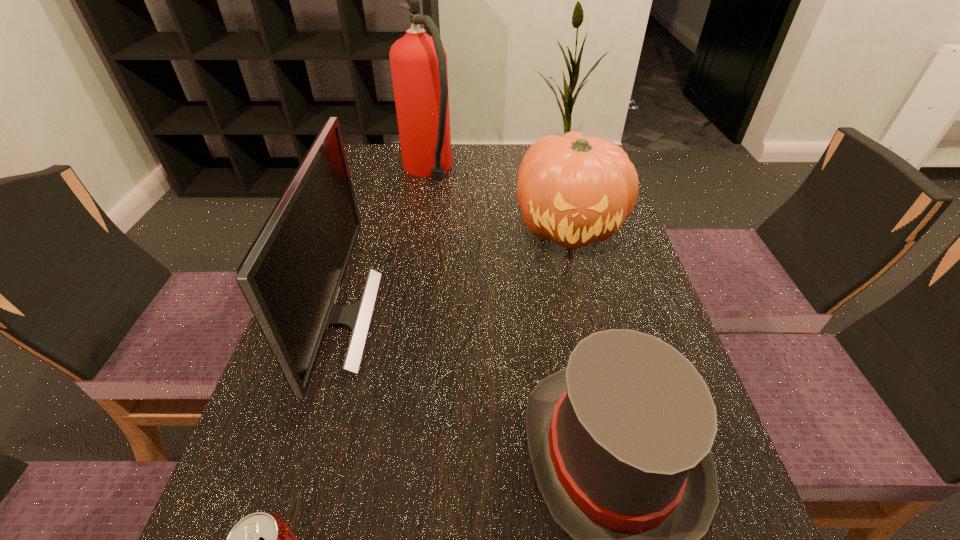
The image size is (960, 540). In order to click on vacant region at the far edge in this screenshot , I will do `click(468, 165)`.

Locate an element on the screen. This screenshot has height=540, width=960. free space at the left edge is located at coordinates (396, 226).

Locate an element on the screen. free space at the right edge of the desktop is located at coordinates (614, 293).

The height and width of the screenshot is (540, 960). I want to click on vacant position at the far left corner of the desktop, so click(365, 170).

I want to click on free area in between the monitor and the pumpkin, so click(x=452, y=273).

Where is `vacant space that is in between the monitor and the tallest object`? vacant space that is in between the monitor and the tallest object is located at coordinates (382, 245).

This screenshot has width=960, height=540. In order to click on empty space that is in between the third shortest object and the fire extinguisher in this screenshot , I will do `click(498, 199)`.

Locate an element on the screen. This screenshot has height=540, width=960. vacant point located between the third tallest object and the fire extinguisher is located at coordinates (498, 199).

This screenshot has width=960, height=540. In order to click on object that ranks as the second closest to the tallest object in this screenshot , I will do `click(291, 276)`.

Locate an element on the screen. The image size is (960, 540). object that can be found as the fourth closest to the fourth shortest object is located at coordinates (574, 190).